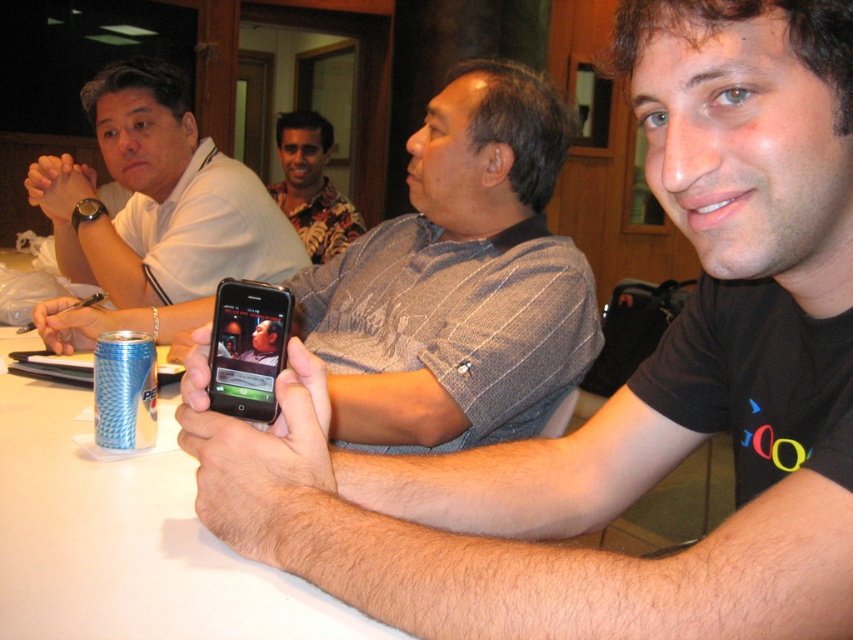
Where is `matte black phone at center`? matte black phone at center is located at coordinates (459, 280).

Is matte black phone at center bigger than blue textured can at lower left?

Indeed, matte black phone at center has a larger size compared to blue textured can at lower left.

The width and height of the screenshot is (853, 640). I want to click on matte black phone at center, so click(459, 280).

Find the location of a particular element. This screenshot has height=640, width=853. matte black phone at center is located at coordinates (459, 280).

Which of these two, black glossy smartphone at center or blue textured can at lower left, stands taller?

Standing taller between the two is blue textured can at lower left.

Who is more forward, (254, 396) or (125, 358)?

Point (254, 396) is in front.

Image resolution: width=853 pixels, height=640 pixels. Identify the location of black glossy smartphone at center. (248, 348).

Is matte black phone at center to the left of floral shirt at center from the viewer's perspective?

Incorrect, matte black phone at center is not on the left side of floral shirt at center.

Is matte black phone at center shorter than floral shirt at center?

Indeed, matte black phone at center has a lesser height compared to floral shirt at center.

Does point (347, 436) come in front of point (349, 234)?

Yes, it is in front of point (349, 234).

Locate an element on the screen. The width and height of the screenshot is (853, 640). matte black phone at center is located at coordinates (459, 280).